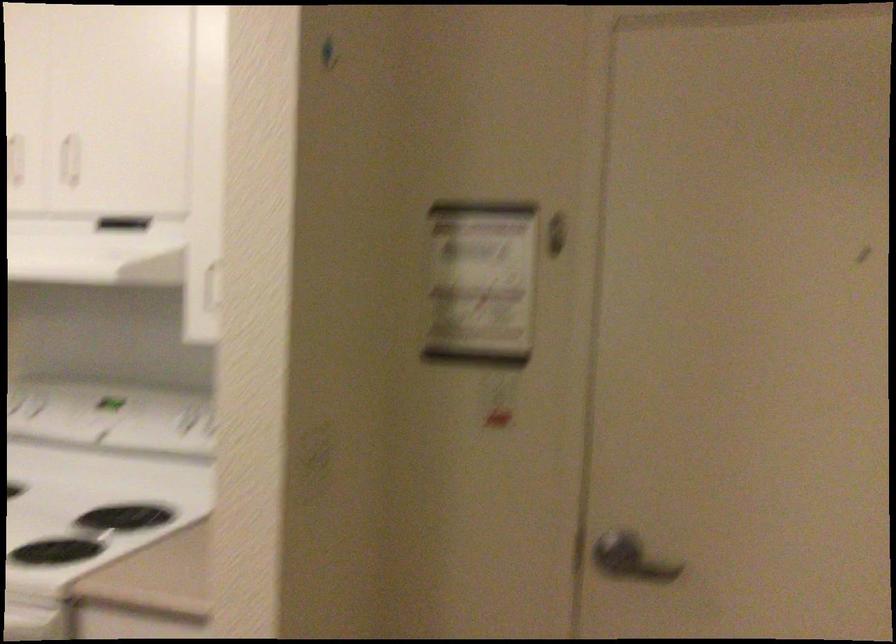
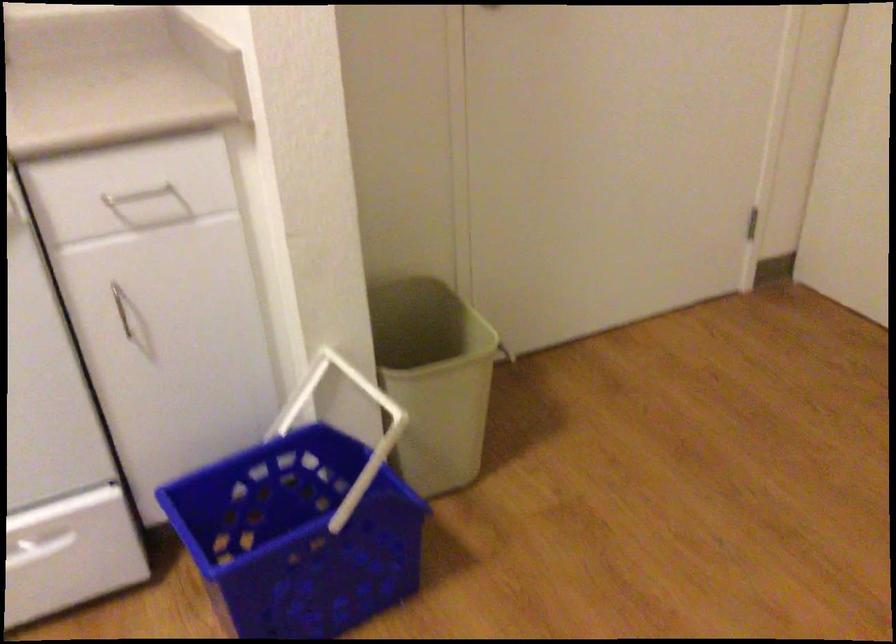
First-person continuous shooting, in which direction is the camera rotating?

The rotation direction of the camera is right-down.